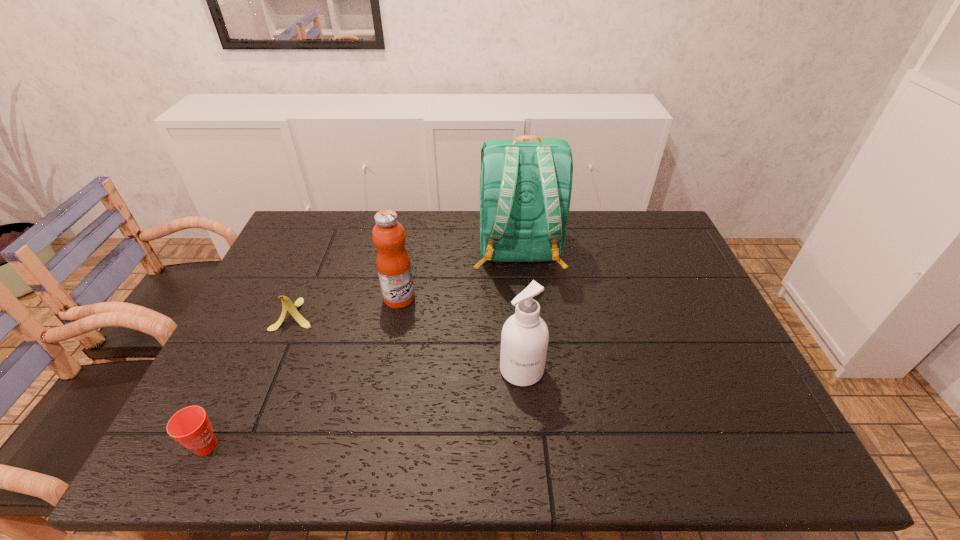
Where is `blank space located on the back of the nearest object`? The width and height of the screenshot is (960, 540). blank space located on the back of the nearest object is located at coordinates (259, 336).

Find the location of `object present at the far edge`. object present at the far edge is located at coordinates pyautogui.click(x=525, y=187).

The width and height of the screenshot is (960, 540). In order to click on object present at the near edge in this screenshot , I will do `click(190, 426)`.

Identify the location of banana that is at the left edge. Image resolution: width=960 pixels, height=540 pixels. (288, 306).

The width and height of the screenshot is (960, 540). In order to click on cup situated at the left edge in this screenshot , I will do `click(190, 426)`.

The height and width of the screenshot is (540, 960). I want to click on object at the near left corner, so click(x=190, y=426).

In the image, there is a desktop. At what (x,y) coordinates should I click in order to perform the action: click on free space at the far edge. Please return your answer as a coordinate pair (x, y). The height and width of the screenshot is (540, 960). Looking at the image, I should click on (416, 233).

In the image, there is a desktop. Where is `vacant area at the near edge`? vacant area at the near edge is located at coordinates (614, 441).

This screenshot has height=540, width=960. I want to click on vacant space at the left edge, so click(233, 331).

The image size is (960, 540). In the image, there is a desktop. Identify the location of free space at the right edge. (661, 324).